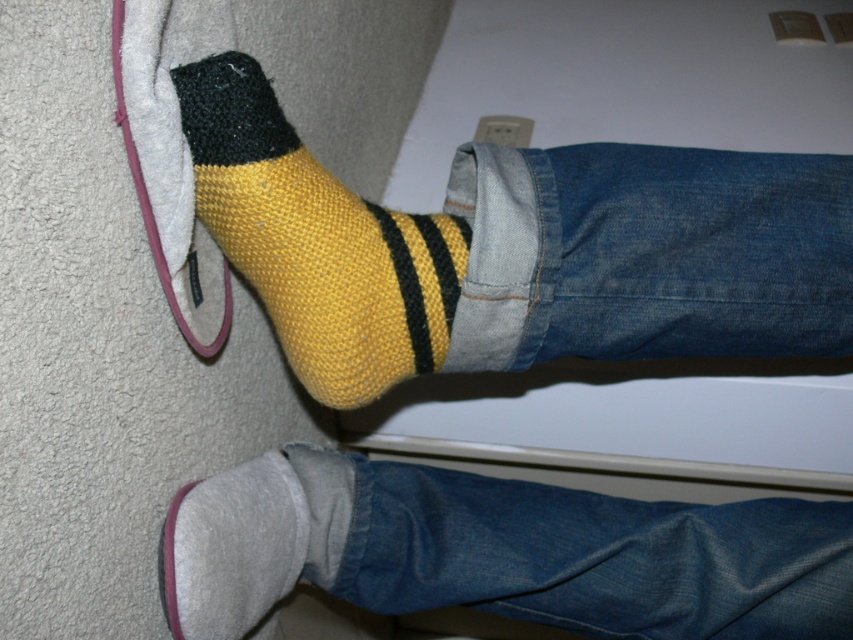
Question: Which point appears closest to the camera in this image?

Choices:
 (A) (328, 369)
 (B) (519, 236)
 (C) (172, 540)
 (D) (213, 628)

Answer: (C)

Question: Can you confirm if yellow knitted sock at upper left is positioned to the right of yellow knitted sock at lower left?

Choices:
 (A) no
 (B) yes

Answer: (B)

Question: Which point is farther to the camera?

Choices:
 (A) gray fabric sock at lower left
 (B) yellow knitted sock at lower left
 (C) gray fuzzy slipper at lower left
 (D) yellow knitted sock at upper left

Answer: (A)

Question: Which point appears closest to the camera in this image?

Choices:
 (A) (637, 596)
 (B) (312, 257)

Answer: (B)

Question: Is yellow knitted sock at lower left positioned in front of gray fuzzy slipper at lower left?

Choices:
 (A) yes
 (B) no

Answer: (A)

Question: In this image, where is yellow knitted sock at upper left located relative to yellow knitted sock at lower left?

Choices:
 (A) above
 (B) below

Answer: (B)